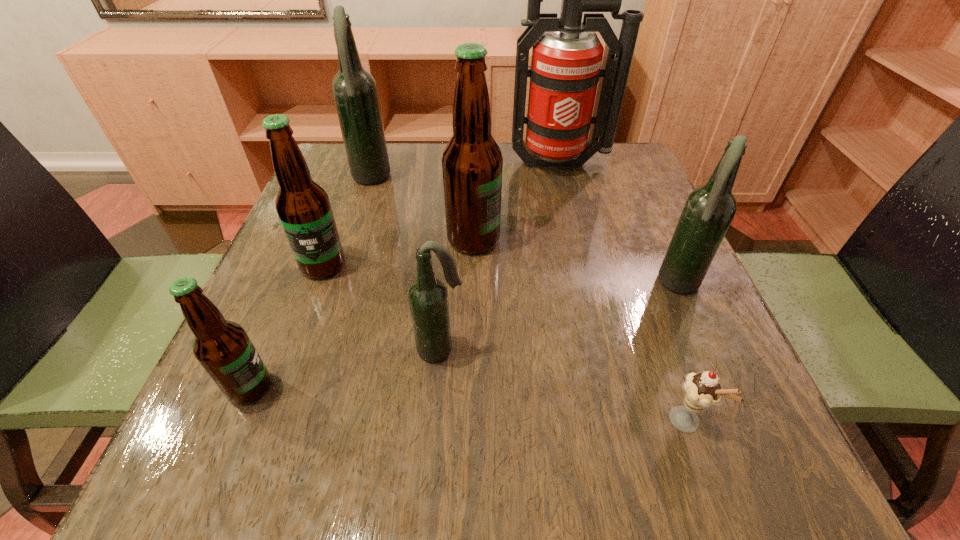
Locate an element on the screen. fire extinguisher located in the far edge section of the desktop is located at coordinates (567, 54).

Find the location of a particular element. The image size is (960, 540). beer bottle present at the far edge is located at coordinates (355, 92).

Image resolution: width=960 pixels, height=540 pixels. In order to click on object at the near edge in this screenshot , I will do `click(702, 390)`.

Image resolution: width=960 pixels, height=540 pixels. In order to click on fire extinguisher that is at the right edge in this screenshot , I will do `click(567, 54)`.

Find the location of a particular element. Image resolution: width=960 pixels, height=540 pixels. beer bottle present at the right edge is located at coordinates (709, 210).

Locate an element on the screen. This screenshot has height=540, width=960. icecream located in the right edge section of the desktop is located at coordinates (702, 390).

I want to click on object positioned at the far left corner, so click(x=355, y=92).

At what (x,y) coordinates should I click in order to perform the action: click on object located in the far right corner section of the desktop. Please return your answer as a coordinate pair (x, y). Image resolution: width=960 pixels, height=540 pixels. Looking at the image, I should click on (567, 54).

Locate an element on the screen. The image size is (960, 540). object that is at the near right corner is located at coordinates (702, 390).

In the image, there is a desktop. At what (x,y) coordinates should I click in order to perform the action: click on vacant space at the far edge. Please return your answer as a coordinate pair (x, y). The image size is (960, 540). Looking at the image, I should click on (417, 189).